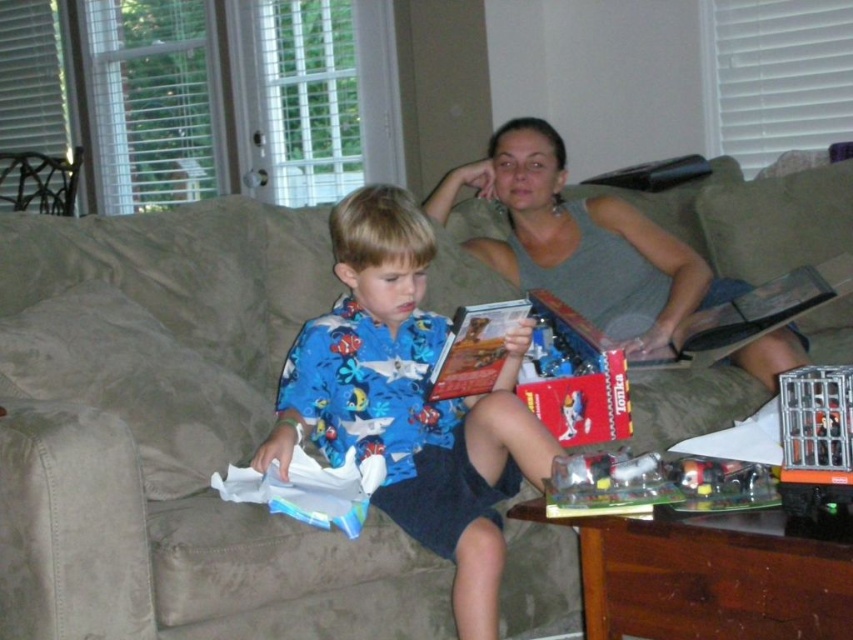
Question: Which point is closer to the camera taking this photo?

Choices:
 (A) (396, 314)
 (B) (767, 346)
 (C) (840, 468)

Answer: (C)

Question: Does blue cotton shirt at center appear on the left side of hardcover book at center?

Choices:
 (A) yes
 (B) no

Answer: (A)

Question: Does metallic silver cage at lower right appear on the right side of hardcover book at center?

Choices:
 (A) no
 (B) yes

Answer: (B)

Question: Can you confirm if gray fabric couch at upper center is bigger than metallic silver cage at lower right?

Choices:
 (A) yes
 (B) no

Answer: (A)

Question: Among these points, which one is nearest to the camera?

Choices:
 (A) (39, 184)
 (B) (486, 372)

Answer: (B)

Question: Among these objects, which one is farthest from the camera?

Choices:
 (A) gray fabric couch at upper center
 (B) hardcover book at center

Answer: (A)